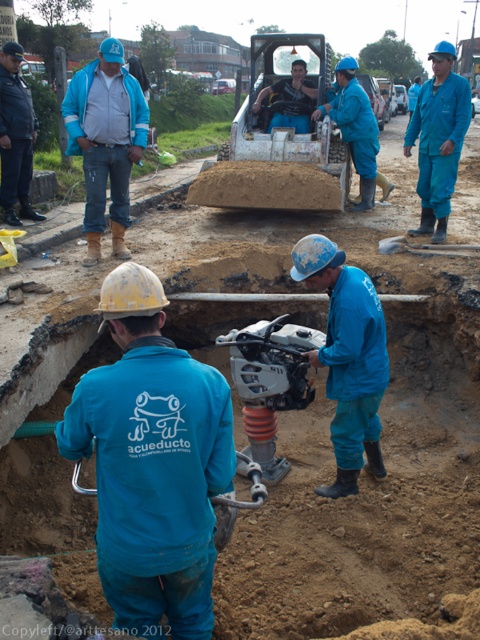
You are a safety inspector at the construction site. You notice a point at coordinates (x=439, y=138). Where is this point located?

The point at coordinates (x=439, y=138) is located on the blue matte jumpsuit at center.

You are a safety inspector reviewing this construction site image. You notice the matte blue jacket at upper left and the matte blue helmet at center. Which object takes up more area in the image?

The matte blue helmet at center takes up more area in the image than the matte blue jacket at upper left.